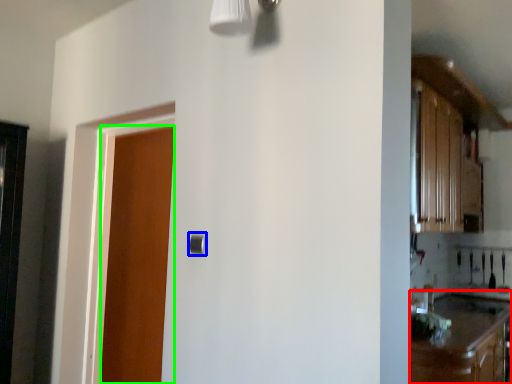
Question: Estimate the real-world distances between objects in this image. Which object is farther from cabinetry (highlighted by a red box), door handle (highlighted by a blue box) or door (highlighted by a green box)?

Choices:
 (A) door handle
 (B) door

Answer: (B)